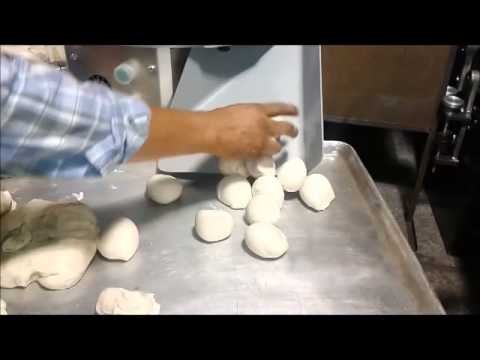
This screenshot has height=360, width=480. I want to click on knob, so click(121, 69).